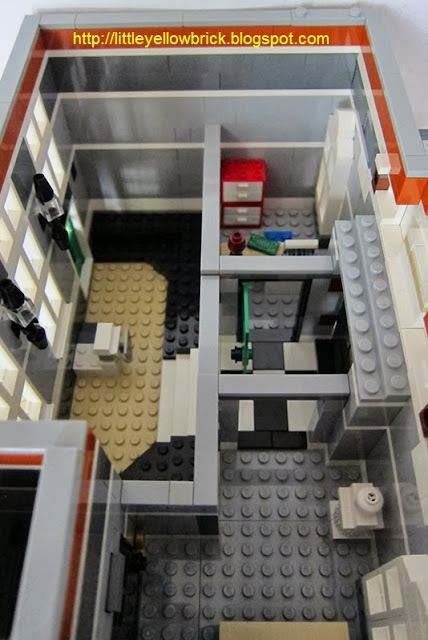
Locate an element on the screen. This screenshot has height=640, width=428. door is located at coordinates (78, 257).